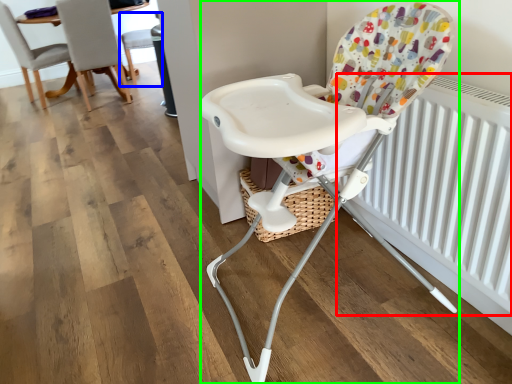
Question: Estimate the real-world distances between objects in this image. Which object is farther from radiator (highlighted by a red box), chair (highlighted by a blue box) or chair (highlighted by a green box)?

Choices:
 (A) chair
 (B) chair

Answer: (A)